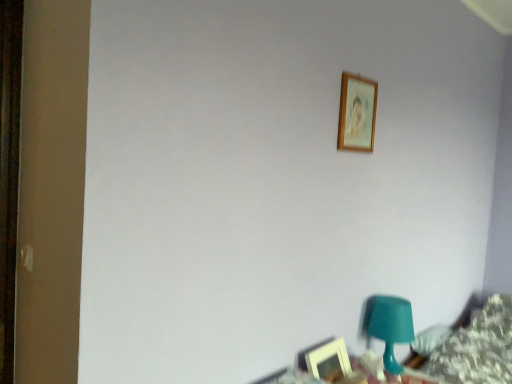
Question: Considering their positions, is wooden picture frame at upper center, the 2th picture frame in the bottom-to-top sequence, located in front of or behind wooden picture frame at lower right, which ranks as the second picture frame in top-to-bottom order?

Choices:
 (A) front
 (B) behind

Answer: (B)

Question: From a real-world perspective, relative to wooden picture frame at lower right, placed as the first picture frame when sorted from bottom to top, is wooden picture frame at upper center, the 2th picture frame in the bottom-to-top sequence, vertically above or below?

Choices:
 (A) below
 (B) above

Answer: (B)

Question: Estimate the real-world distances between objects in this image. Which object is closer to the teal plastic table at lower right?

Choices:
 (A) wooden picture frame at lower right, which ranks as the second picture frame in top-to-bottom order
 (B) teal plastic table lamp at lower right
 (C) wooden picture frame at upper center, the 2th picture frame in the bottom-to-top sequence

Answer: (A)

Question: Which is nearer to the teal plastic table lamp at lower right?

Choices:
 (A) wooden picture frame at lower right, placed as the first picture frame when sorted from bottom to top
 (B) wooden picture frame at upper center, the 2th picture frame in the bottom-to-top sequence
 (C) teal plastic table at lower right

Answer: (C)